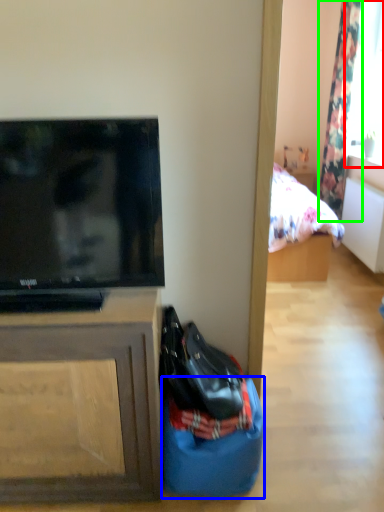
Question: Estimate the real-world distances between objects in this image. Which object is closer to window screen (highlighted by a red box), sack (highlighted by a blue box) or curtain (highlighted by a green box)?

Choices:
 (A) sack
 (B) curtain

Answer: (B)